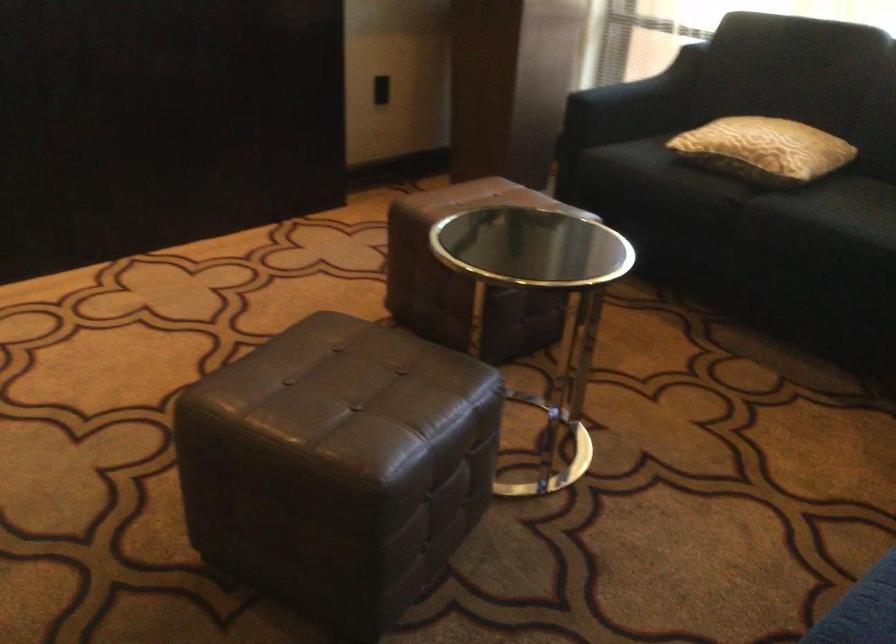
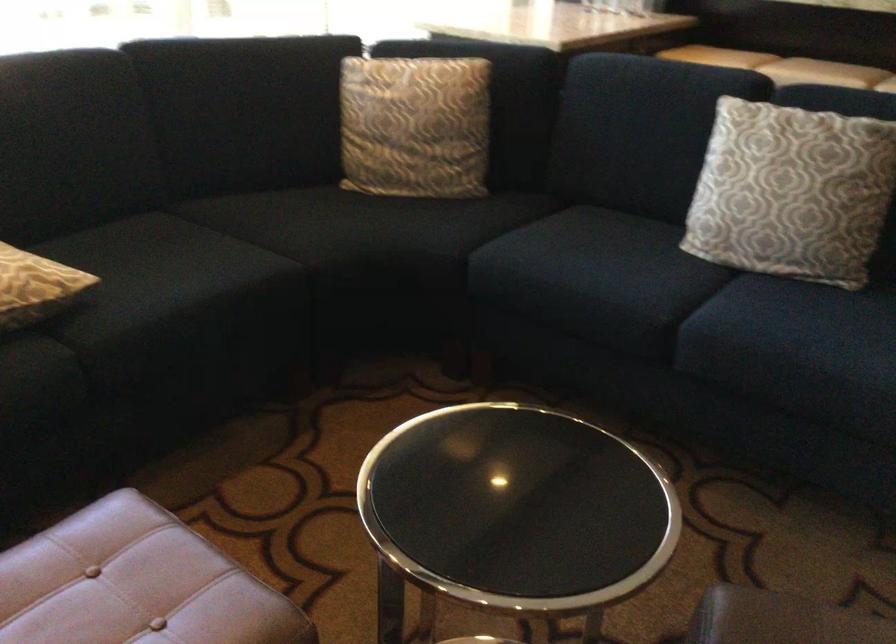
The point at (771,158) is marked in the first image. Where is the corresponding point in the second image?

(35, 287)